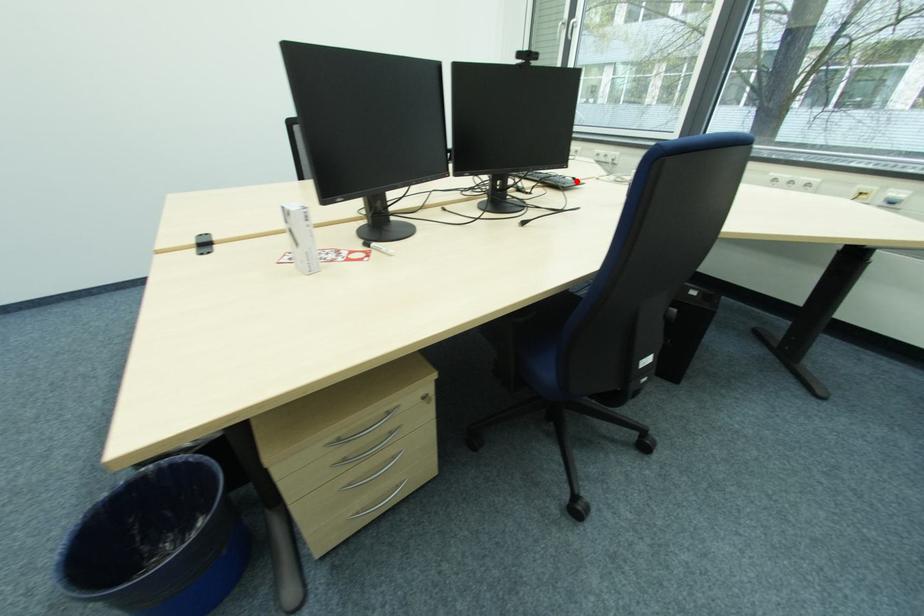
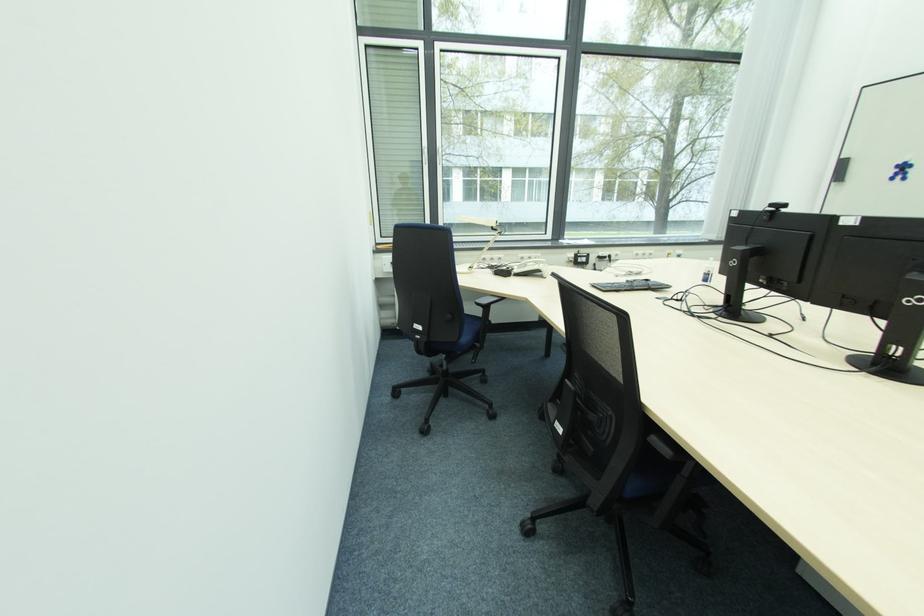
Where in the second image is the point corresponding to the highlighted location from the first image?

(650, 283)